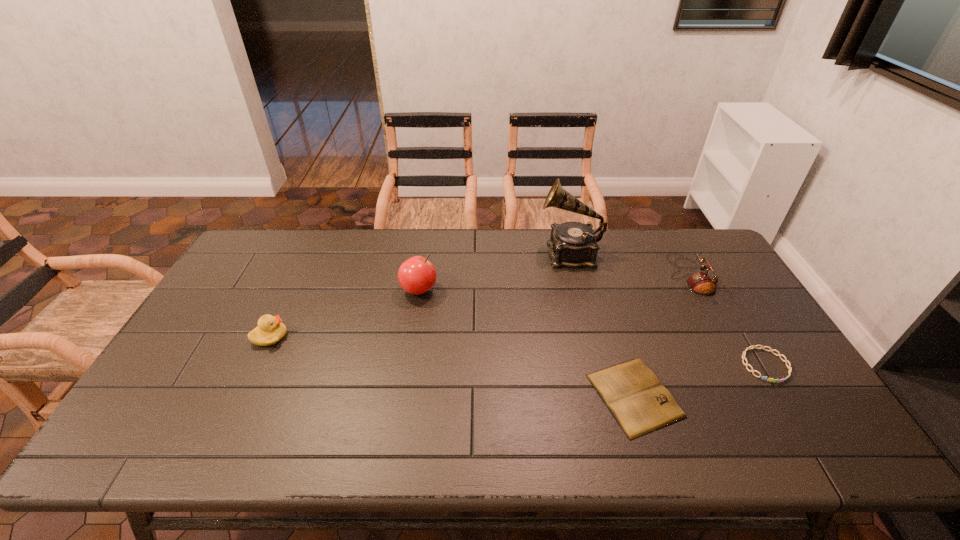
The width and height of the screenshot is (960, 540). I want to click on vacant space located 0.200m on the horn of the tallest object, so click(x=482, y=253).

Image resolution: width=960 pixels, height=540 pixels. Identify the location of free space located 0.210m on the left of the fifth object from right to left. (334, 289).

Locate an element on the screen. The width and height of the screenshot is (960, 540). blank space located 0.060m on the rotary dial of the telephone is located at coordinates (x=652, y=275).

Locate an element on the screen. The image size is (960, 540). vacant space located on the rotary dial of the telephone is located at coordinates (612, 275).

Image resolution: width=960 pixels, height=540 pixels. I want to click on free spot located 0.280m on the rotary dial of the telephone, so click(585, 275).

In order to click on free space located on the beak of the duckling in this screenshot , I will do `click(318, 337)`.

At what (x,y) coordinates should I click in order to perform the action: click on vacant area located 0.070m on the surface of the bracelet showing star-shaped elements. Please return your answer as a coordinate pair (x, y). Image resolution: width=960 pixels, height=540 pixels. Looking at the image, I should click on (791, 407).

This screenshot has height=540, width=960. In order to click on free space located on the back of the book in this screenshot , I will do `click(594, 266)`.

The image size is (960, 540). What are the coordinates of `phonograph record that is at the far edge` in the screenshot? It's located at (572, 244).

You are a GUI agent. You are given a task and a screenshot of the screen. Output one action in this format:
    pyautogui.click(x=<x>, y=<y>)
    Task: Click on the telephone positioned at the far edge
    The image size is (960, 540).
    Given the screenshot: What is the action you would take?
    pyautogui.click(x=701, y=283)